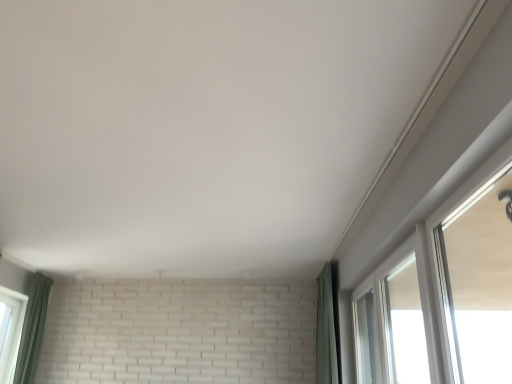
Question: Is green fabric curtain at right, the first curtain when ordered from right to left, thinner than transparent glass window at upper right, the first window in the back-to-front sequence?

Choices:
 (A) yes
 (B) no

Answer: (B)

Question: Can we say green fabric curtain at right, positioned as the 2th curtain in left-to-right order, lies outside transparent glass window at upper right, the first window in the back-to-front sequence?

Choices:
 (A) no
 (B) yes

Answer: (B)

Question: Is green fabric curtain at right, positioned as the 2th curtain in left-to-right order, not near transparent glass window at upper right, positioned as the 2th window in front-to-back order?

Choices:
 (A) no
 (B) yes

Answer: (A)

Question: Is green fabric curtain at right, positioned as the 2th curtain in left-to-right order, positioned with its back to transparent glass window at upper right, the first window in the back-to-front sequence?

Choices:
 (A) yes
 (B) no

Answer: (B)

Question: From the image's perspective, is green fabric curtain at right, positioned as the 2th curtain in left-to-right order, above transparent glass window at upper right, the first window in the back-to-front sequence?

Choices:
 (A) yes
 (B) no

Answer: (B)

Question: Considering the relative positions of green fabric curtain at lower left, which is the second curtain in right-to-left order, and white glossy window at upper right, placed as the 1th window when sorted from front to back, in the image provided, is green fabric curtain at lower left, which is the second curtain in right-to-left order, to the left or to the right of white glossy window at upper right, placed as the 1th window when sorted from front to back,?

Choices:
 (A) right
 (B) left

Answer: (B)

Question: Looking at their shapes, would you say green fabric curtain at lower left, which is the second curtain in right-to-left order, is wider or thinner than white glossy window at upper right, positioned as the second window in back-to-front order?

Choices:
 (A) wide
 (B) thin

Answer: (A)

Question: From the image's perspective, is green fabric curtain at lower left, which is the second curtain in right-to-left order, above or below white glossy window at upper right, placed as the 1th window when sorted from front to back?

Choices:
 (A) above
 (B) below

Answer: (B)

Question: Is green fabric curtain at lower left, placed as the 1th curtain when sorted from left to right, spatially inside white glossy window at upper right, positioned as the second window in back-to-front order, or outside of it?

Choices:
 (A) inside
 (B) outside

Answer: (B)

Question: Is transparent glass window at upper right, the first window in the back-to-front sequence, in front of or behind green fabric curtain at lower left, which is the second curtain in right-to-left order, in the image?

Choices:
 (A) behind
 (B) front

Answer: (B)

Question: From a real-world perspective, is transparent glass window at upper right, the first window in the back-to-front sequence, physically located above or below green fabric curtain at lower left, which is the second curtain in right-to-left order?

Choices:
 (A) above
 (B) below

Answer: (B)

Question: In the image, is transparent glass window at upper right, the first window in the back-to-front sequence, on the left side or the right side of green fabric curtain at lower left, which is the second curtain in right-to-left order?

Choices:
 (A) right
 (B) left

Answer: (A)

Question: Is point (404, 362) positioned closer to the camera than point (34, 334)?

Choices:
 (A) closer
 (B) farther

Answer: (A)

Question: From a real-world perspective, is transparent glass window at upper right, the first window in the back-to-front sequence, physically located above or below green fabric curtain at right, positioned as the 2th curtain in left-to-right order?

Choices:
 (A) above
 (B) below

Answer: (B)

Question: Considering the positions of transparent glass window at upper right, positioned as the 2th window in front-to-back order, and green fabric curtain at right, the first curtain when ordered from right to left, in the image, is transparent glass window at upper right, positioned as the 2th window in front-to-back order, taller or shorter than green fabric curtain at right, the first curtain when ordered from right to left,?

Choices:
 (A) short
 (B) tall

Answer: (A)